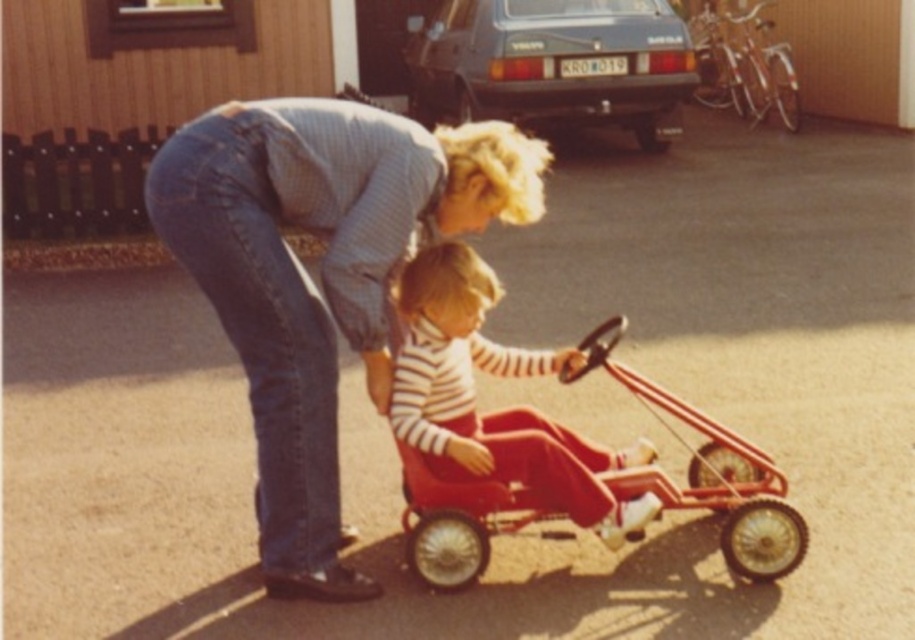
Based on the scene description, where is the striped fabric toddler at center positioned in the image?

The striped fabric toddler at center is positioned at point 0.644 on the x axis and 0.544 on the y axis.

You are a delivery person trying to deliver a package to the address shown in the image. You need to determine if the denim jeans at center and the matte black car at upper center are blocking the driveway. Based on their heights, can you tell which one is taller and might be an obstacle?

The denim jeans at center has a lesser height compared to the matte black car at upper center, so the matte black car at upper center is taller and could be an obstacle blocking the driveway.

You are a photographer trying to capture a photo of both the matte black car at upper center and the metallic red toy car at center. From which side should you position yourself to ensure both cars are fully visible in the frame?

You should position yourself to the right side of the metallic red toy car at center so that the matte black car at upper center to the left of metallic red toy car at center can be captured in the frame.